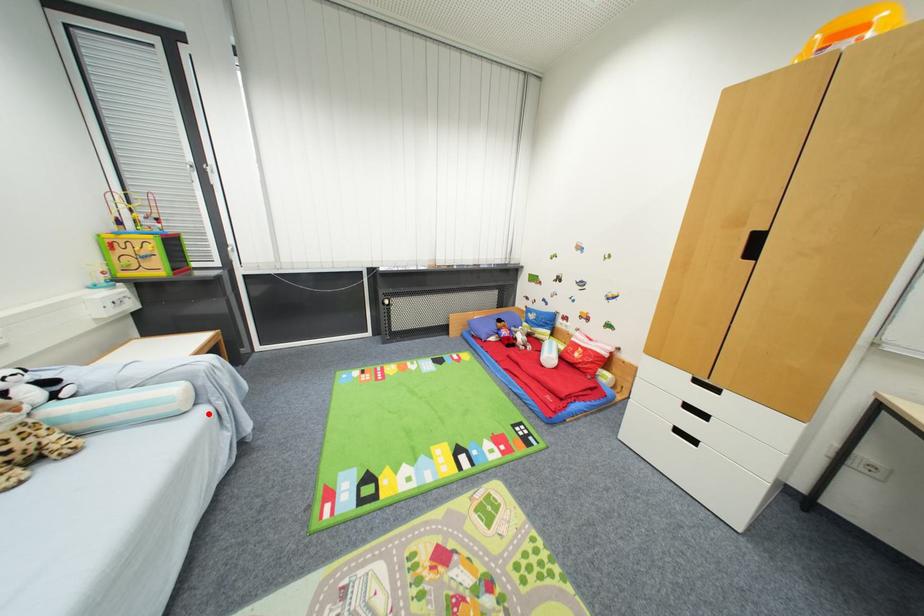
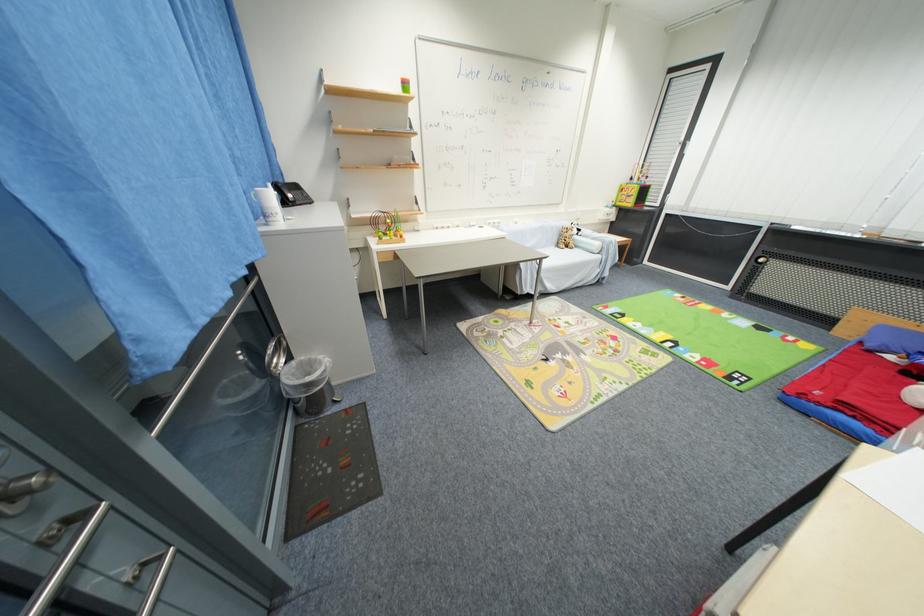
The point at the highlighted location is marked in the first image. Where is the corresponding point in the second image?

(603, 259)